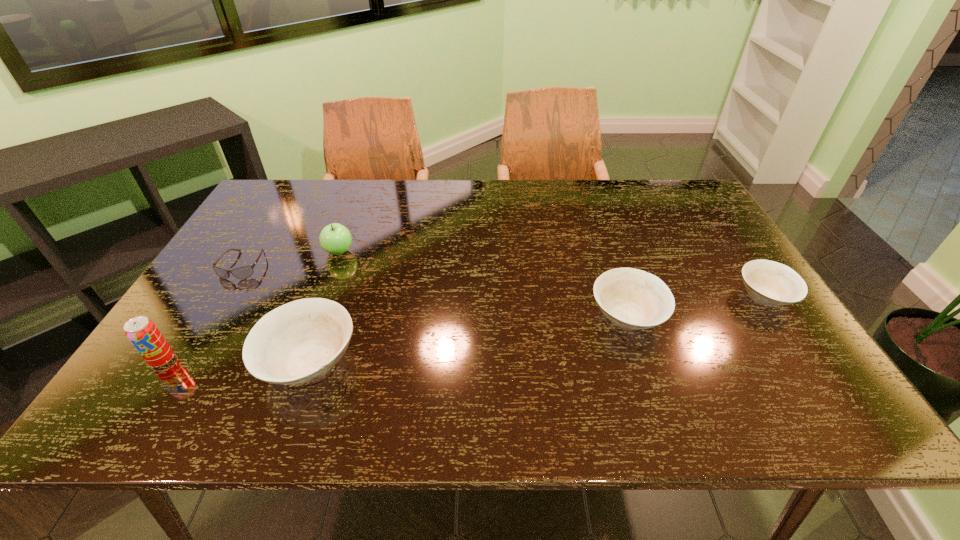
Where is `empty space that is in between the fifth object from left to right and the sunglasses`? This screenshot has height=540, width=960. empty space that is in between the fifth object from left to right and the sunglasses is located at coordinates (435, 291).

This screenshot has height=540, width=960. I want to click on free point between the fifth tallest object and the apple, so click(x=552, y=274).

Identify the location of vacant area between the tallest object and the apple. pyautogui.click(x=251, y=306).

Identify which object is located as the nearest to the fifth object from left to right. Please provide its 2D coordinates. Your answer should be formatted as a tuple, i.e. [(x, y)], where the tuple contains the x and y coordinates of a point satisfying the conditions above.

[(768, 282)]

Identify which object is the fifth nearest to the tallest bowl. Please provide its 2D coordinates. Your answer should be formatted as a tuple, i.e. [(x, y)], where the tuple contains the x and y coordinates of a point satisfying the conditions above.

[(768, 282)]

I want to click on bowl that is the second closest to the fourth tallest object, so click(298, 342).

I want to click on the second closest bowl to the rightmost bowl, so click(x=298, y=342).

This screenshot has height=540, width=960. I want to click on blank space that satisfies the following two spatial constraints: 1. on the lenses of the second bowl from left to right; 2. on the right side of the shortest object, so click(211, 316).

This screenshot has width=960, height=540. Identify the location of vacant position in the image that satisfies the following two spatial constraints: 1. on the lenses of the shortest object; 2. on the left side of the rightmost object. (224, 296).

I want to click on vacant space that satisfies the following two spatial constraints: 1. on the back side of the tallest bowl; 2. on the left side of the rightmost object, so click(x=332, y=296).